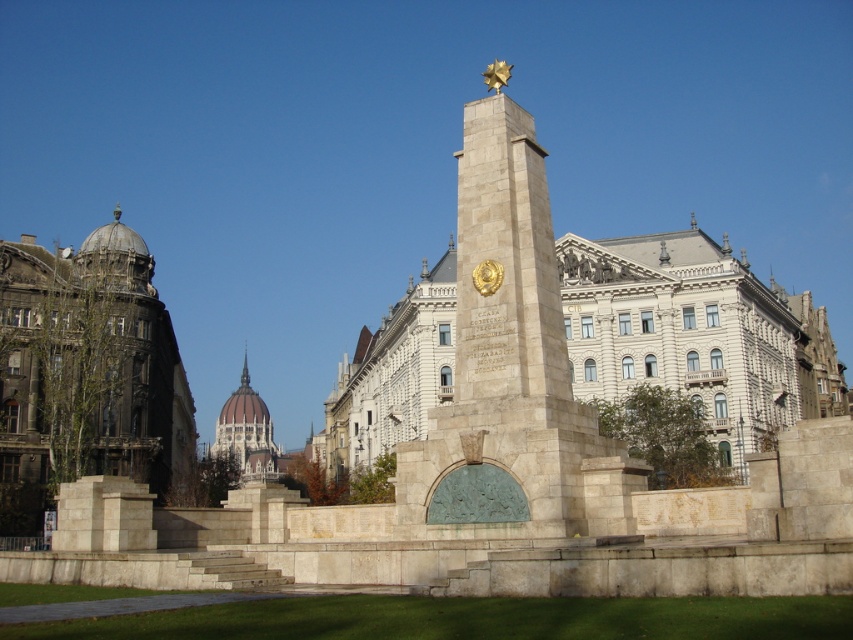
Question: Which object appears farthest from the camera in this image?

Choices:
 (A) greenish stone dome at center
 (B) dark brown stone building at left
 (C) stone obelisk at center
 (D) beige stone monument at center

Answer: (A)

Question: Observing the image, what is the correct spatial positioning of beige stone monument at center in reference to greenish stone dome at center?

Choices:
 (A) below
 (B) above

Answer: (B)

Question: Is beige stone monument at center wider than dark brown stone building at left?

Choices:
 (A) no
 (B) yes

Answer: (B)

Question: Which object appears farthest from the camera in this image?

Choices:
 (A) greenish stone dome at center
 (B) dark brown stone building at left
 (C) stone obelisk at center

Answer: (A)

Question: Does stone obelisk at center have a lesser width compared to greenish stone dome at center?

Choices:
 (A) no
 (B) yes

Answer: (B)

Question: Which object is the closest to the greenish stone dome at center?

Choices:
 (A) stone obelisk at center
 (B) dark brown stone building at left
 (C) beige stone monument at center

Answer: (C)